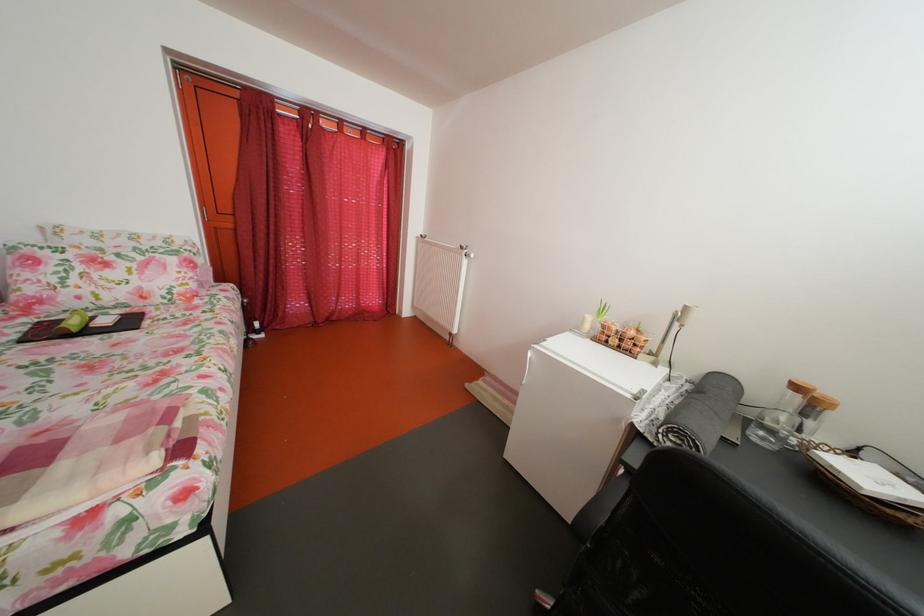
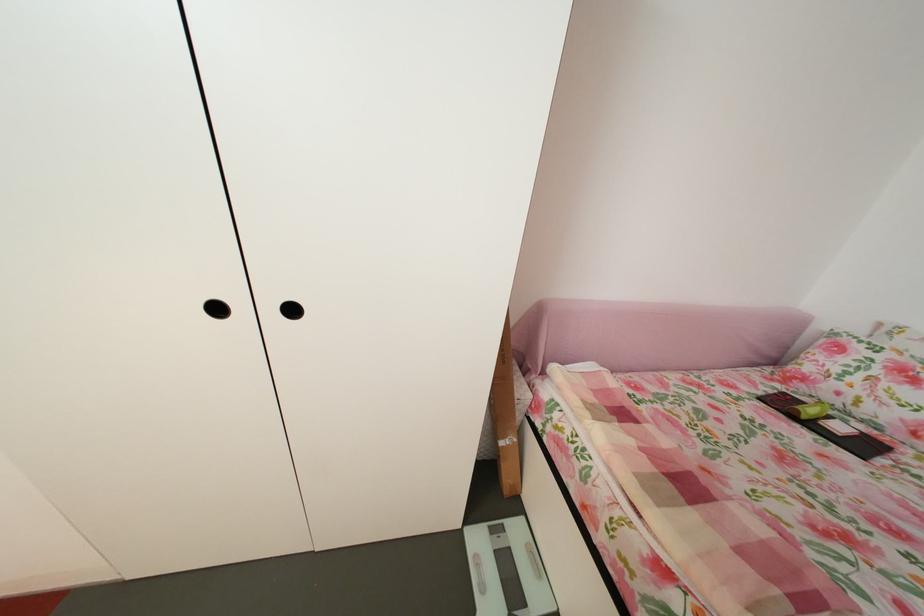
The point at (91, 304) is marked in the first image. Where is the corresponding point in the second image?

(849, 400)